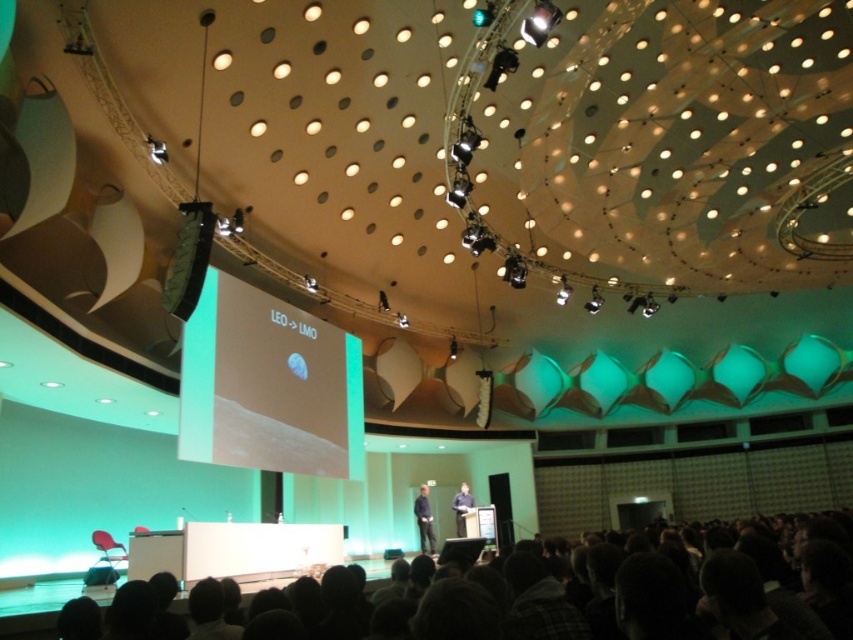
Question: Which of the following is the closest to the observer?

Choices:
 (A) (666, 570)
 (B) (453, 500)
 (C) (427, 545)

Answer: (A)

Question: Can you confirm if dark gray hair at lower center is bigger than black fabric at center?

Choices:
 (A) no
 (B) yes

Answer: (B)

Question: Is dark gray hair at lower center bigger than dark blue fabric at center?

Choices:
 (A) yes
 (B) no

Answer: (A)

Question: Is dark gray hair at lower center bigger than dark blue fabric at center?

Choices:
 (A) yes
 (B) no

Answer: (A)

Question: Which point appears closest to the camera in this image?

Choices:
 (A) (428, 516)
 (B) (664, 627)
 (C) (328, 365)
 (D) (461, 509)

Answer: (B)

Question: Which of these objects is positioned closest to the green matte projection screen at center?

Choices:
 (A) black fabric at center
 (B) dark gray hair at lower center

Answer: (A)